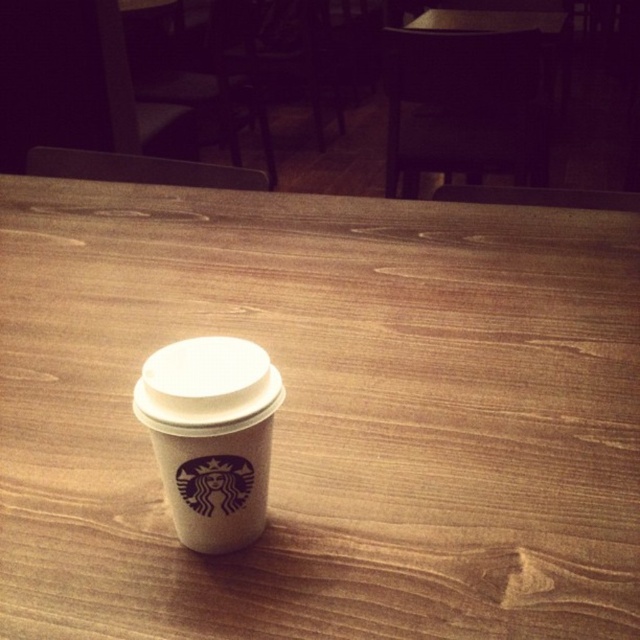
You are setting up a small party and need to place a decorative centerpiece on the wooden table at center. Considering the size of the white paper cup at center already on the table, will there be enough space for the centerpiece?

The wooden table at center has a larger size compared to the white paper cup at center, so there should be enough space for the centerpiece.

You are standing at the edge of the table looking towards the Starbucks coffee cup. There are two points marked on the table surface. One is at point coordinates point (577, 317) and the other at point (196, 346). Which point is closer to you?

Point (196, 346) is closer to you because it is in front of point (577, 317).

You are a barista who needs to place a new cup on the wooden table at center. The existing white paper cup at center is already there. Where should you place the new cup so it doesn not overlap with the existing one?

The wooden table at center is located above the white paper cup at center, so placing the new cup below the existing white paper cup at center would avoid overlapping.